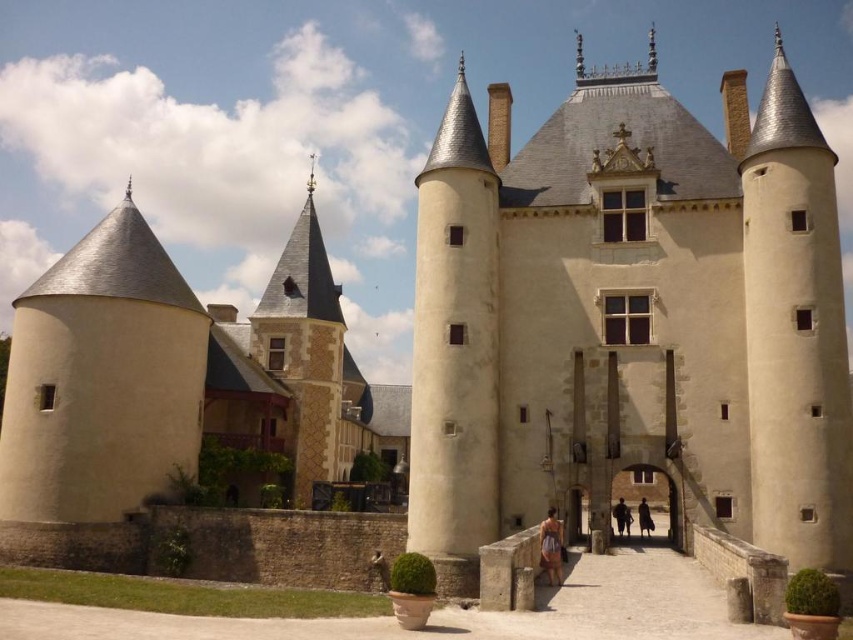
You are standing at the entrance of the castle and looking towards the main tower. There is a point marked at coordinates (631, 317). What object is located at that point?

The beige stone tower at center is located at point (631, 317).

You are a knight standing in front of the castle. You see the beige stone tower at center and the dark brown leather jacket at center. Which object is bigger in size?

The beige stone tower at center is larger in size compared to the dark brown leather jacket at center.